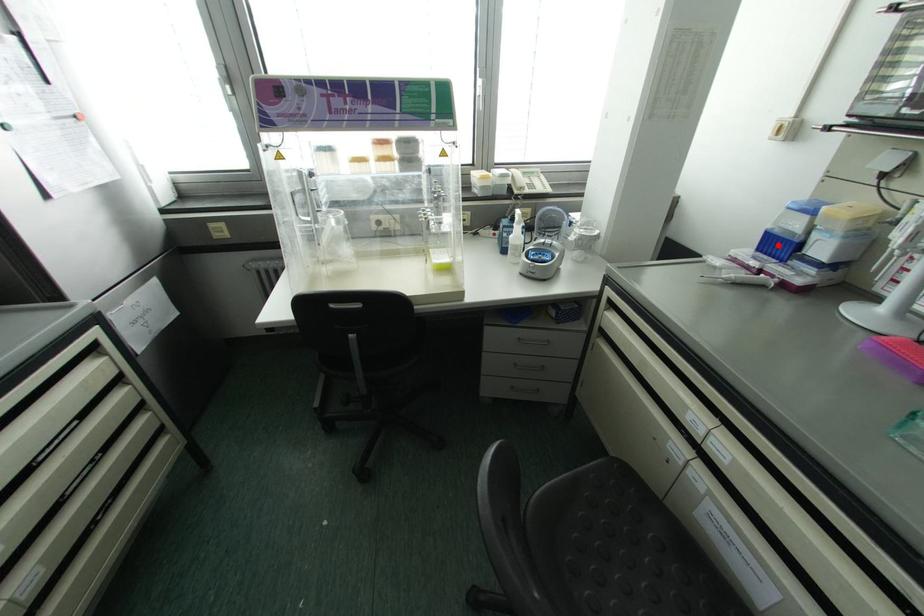
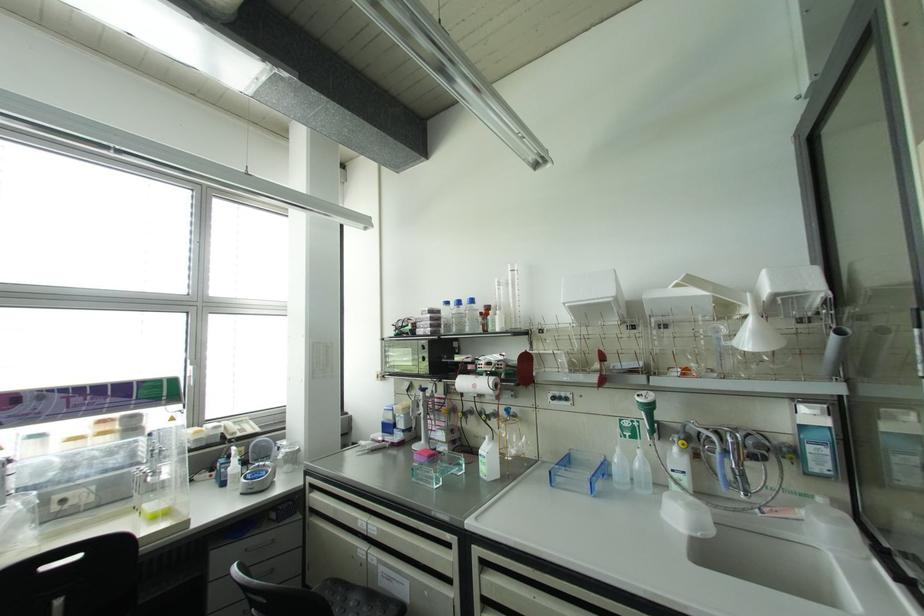
Find the pixel in the second image that matches the highlighted location in the first image.

(387, 427)